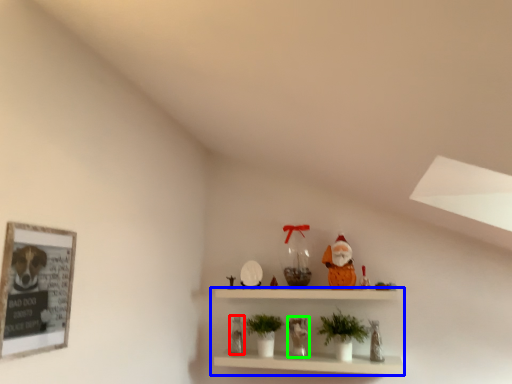
Question: Which object is positioned farthest from toy (highlighted by a red box)? Select from shelf (highlighted by a blue box) and toy (highlighted by a green box).

Choices:
 (A) shelf
 (B) toy

Answer: (A)